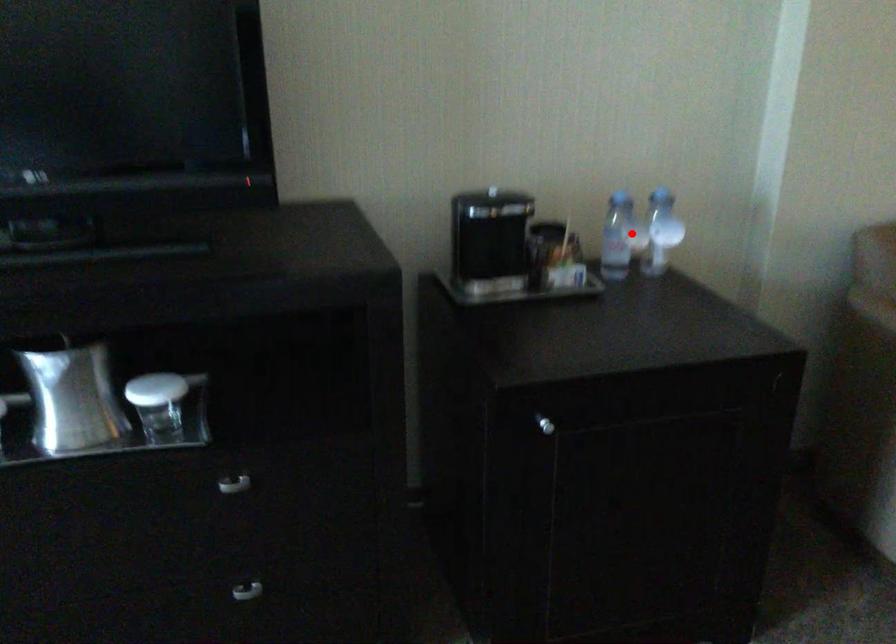
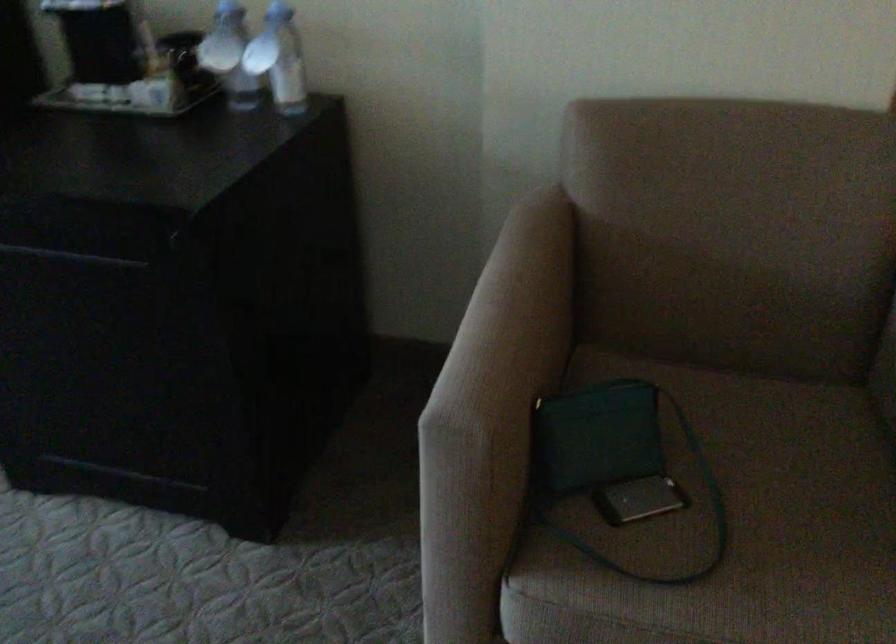
Question: I am providing you with two images of the same scene from different viewpoints. In image1, a red point is highlighted. Considering the same 3D point in image2, which of the following is correct?

Choices:
 (A) It is closer
 (B) It is farther

Answer: (A)